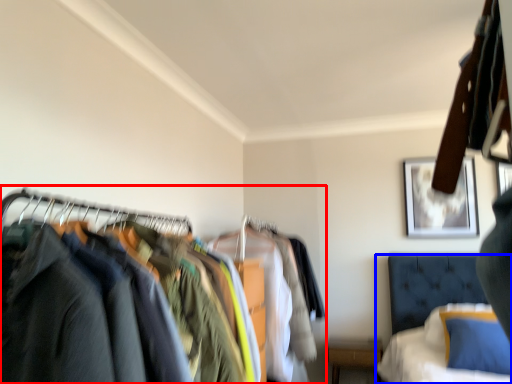
Question: Which object appears closest to the camera in this image, closet (highlighted by a red box) or bed (highlighted by a blue box)?

Choices:
 (A) closet
 (B) bed

Answer: (A)